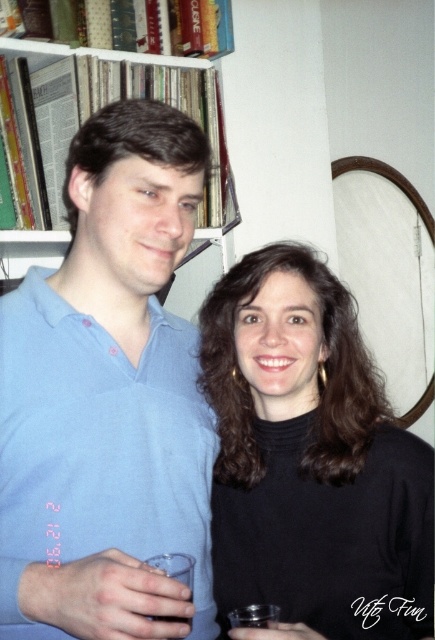
You are trying to place the transparent plastic cup at lower center on the wooden bookshelf at upper left. Can you determine if the cup will fit on the shelf?

The wooden bookshelf at upper left might be wider than transparent plastic cup at lower center, so it is possible that the cup will fit on the shelf. However, the exact dimensions are uncertain based on the provided information.

You are a delivery robot that is 0.5 meters wide. You need to move from the wooden bookshelf at upper left to the clear plastic cup at lower left. Can you fit through the space between them?

The wooden bookshelf at upper left and clear plastic cup at lower left are 1.08 meters apart from each other. Since the robot is 0.5 meters wide, it can easily fit through the space between them as the distance is more than double the robot width.

You are a photographer trying to capture a closeup of the clear plastic cup at lower left without the black matte turtleneck at center blocking the view. Is this possible from your current position?

The clear plastic cup at lower left is behind the black matte turtleneck at center, so it is blocked from view. You would need to adjust your angle or move closer to see it without obstruction.